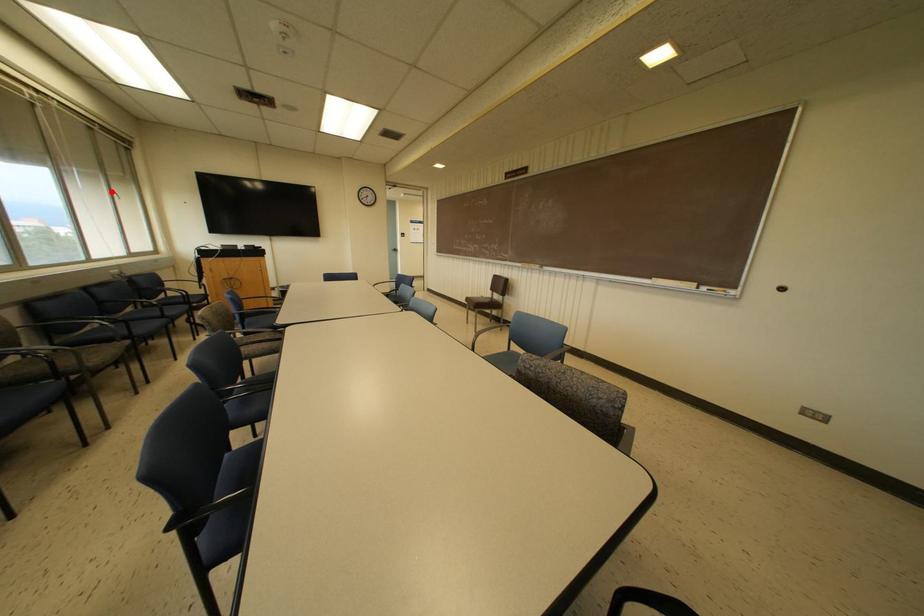
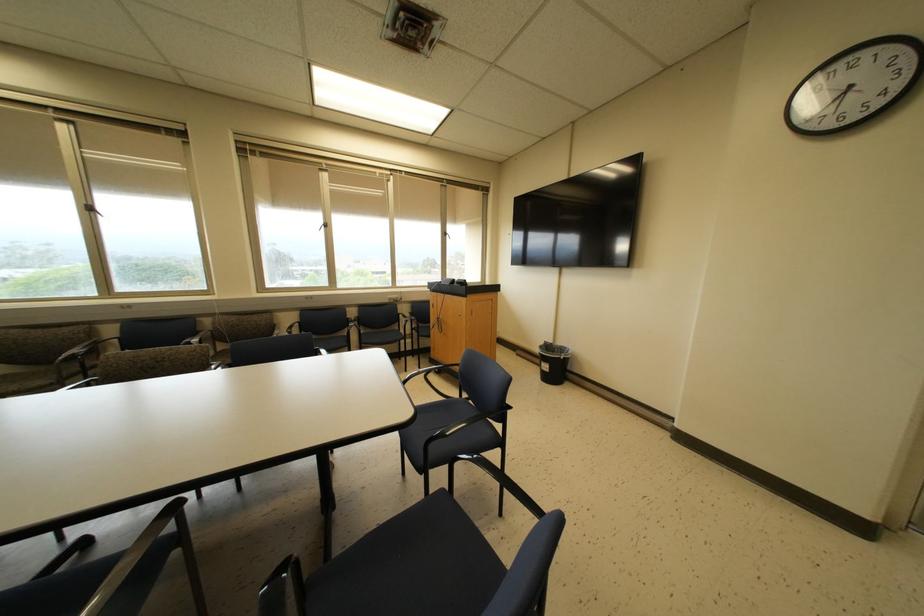
Question: A red point is marked in image1. In image2, is the corresponding 3D point closer to the camera or farther? Reply with the corresponding letter.

Choices:
 (A) The corresponding 3D point is closer.
 (B) The corresponding 3D point is farther.

Answer: (A)